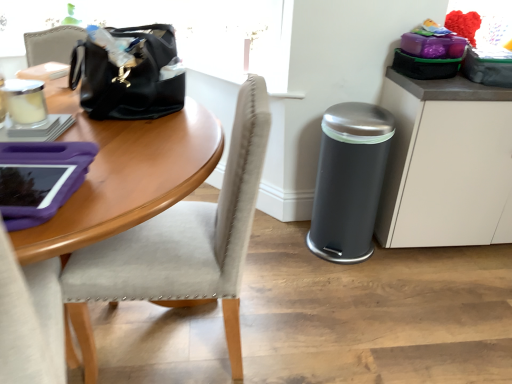
The width and height of the screenshot is (512, 384). Find the location of `vacant space in between matte gray cabinet at right and light gray fabric chair at left`. vacant space in between matte gray cabinet at right and light gray fabric chair at left is located at coordinates point(348,289).